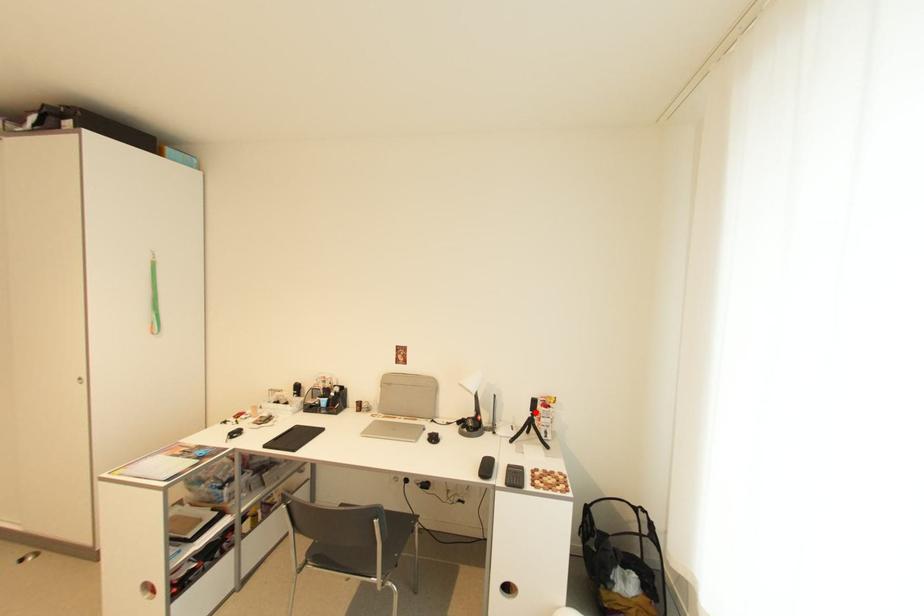
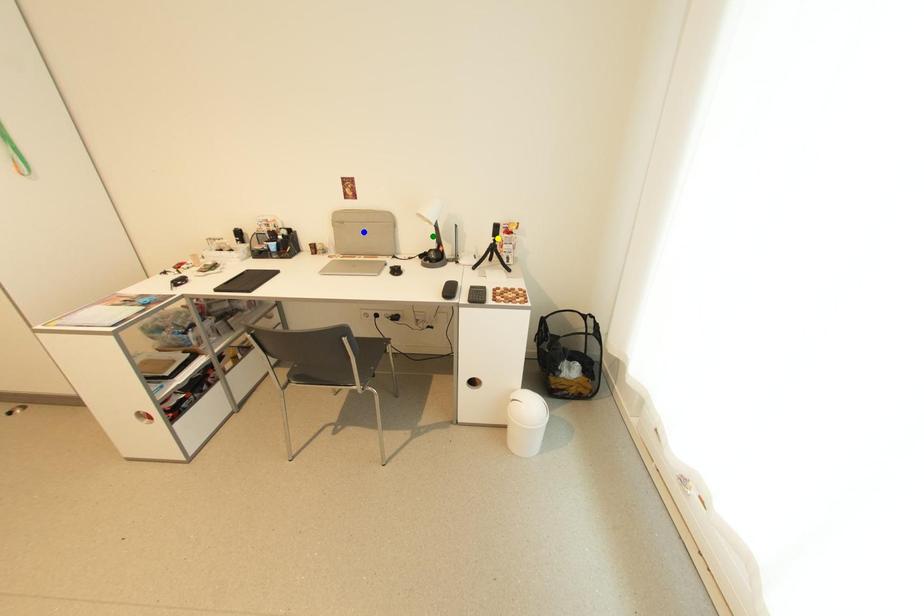
Question: I am providing you with two images of the same scene from different viewpoints. A red point is marked on the first image. You are given multiple points on the second image. Which point in image 2 represents the same 3d spot as the red point in image 1?

Choices:
 (A) green point
 (B) blue point
 (C) yellow point

Answer: (C)